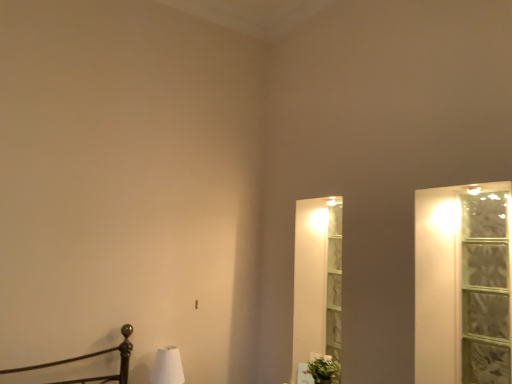
Question: From a real-world perspective, is white matte table lamp at lower left physically located above or below clear glass window at right?

Choices:
 (A) below
 (B) above

Answer: (A)

Question: Is white matte table lamp at lower left wider or thinner than clear glass window at right?

Choices:
 (A) wide
 (B) thin

Answer: (A)

Question: Which of these objects is positioned closest to the white matte table lamp at lower left?

Choices:
 (A) green leafy plant at lower right
 (B) clear glass window at right

Answer: (A)

Question: Which is farther from the clear glass window at right?

Choices:
 (A) white matte table lamp at lower left
 (B) green leafy plant at lower right

Answer: (A)